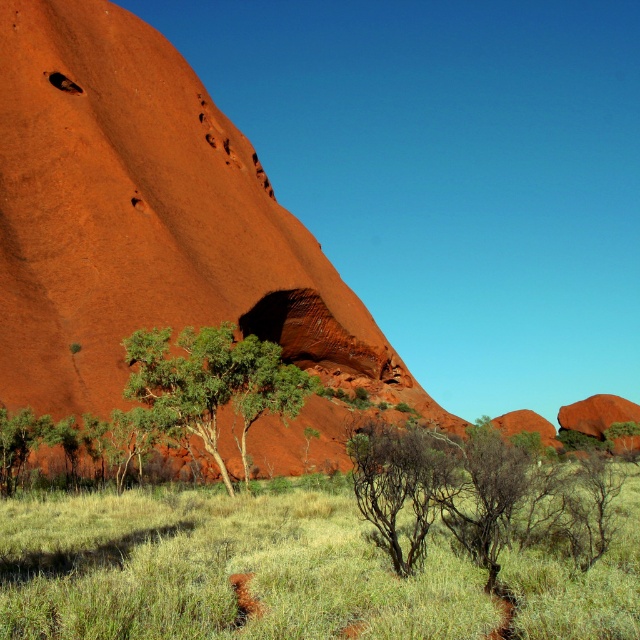
Consider the image. You are a hiker standing at the edge of the grassy area and want to reach the green leafy shrub at center. Which direction should you move relative to the matte orange rock at center?

The green leafy shrub at center is behind the matte orange rock at center, so you should move behind the matte orange rock at center to reach it.